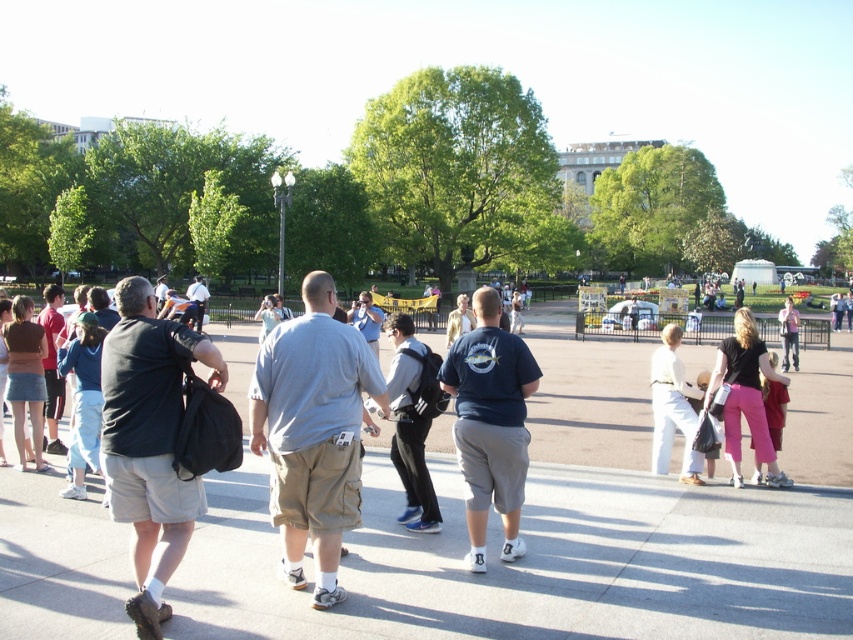
Based on the photo, who is higher up, gray cotton shirt at center or dark gray fabric backpack at left?

Positioned higher is gray cotton shirt at center.

Who is more distant from viewer, (x=259, y=452) or (x=152, y=420)?

The point (x=259, y=452) is behind.

Find the location of a particular element. The height and width of the screenshot is (640, 853). gray cotton shirt at center is located at coordinates (312, 432).

At what (x,y) coordinates should I click in order to perform the action: click on gray cotton shirt at center. Please return your answer as a coordinate pair (x, y). Looking at the image, I should click on (312, 432).

Is gray cotton shirt at center behind dark blue t-shirt at center?

No.

Can you confirm if gray cotton shirt at center is bigger than dark blue t-shirt at center?

Yes, gray cotton shirt at center is bigger than dark blue t-shirt at center.

I want to click on gray cotton shirt at center, so click(x=312, y=432).

Can you confirm if gray concrete pavement at center is positioned to the left of dark gray fabric backpack at left?

In fact, gray concrete pavement at center is to the right of dark gray fabric backpack at left.

Is gray concrete pavement at center positioned at the back of dark gray fabric backpack at left?

Yes, it is.

Is point (495, 540) positioned before point (129, 365)?

No, (495, 540) is further to viewer.

At what (x,y) coordinates should I click in order to perform the action: click on gray concrete pavement at center. Please return your answer as a coordinate pair (x, y). Image resolution: width=853 pixels, height=640 pixels. Looking at the image, I should click on (561, 531).